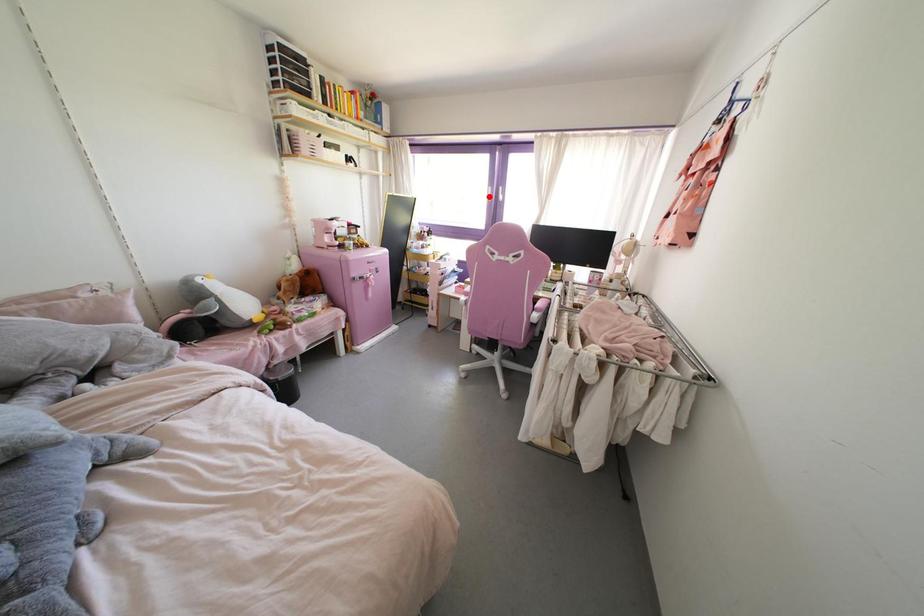
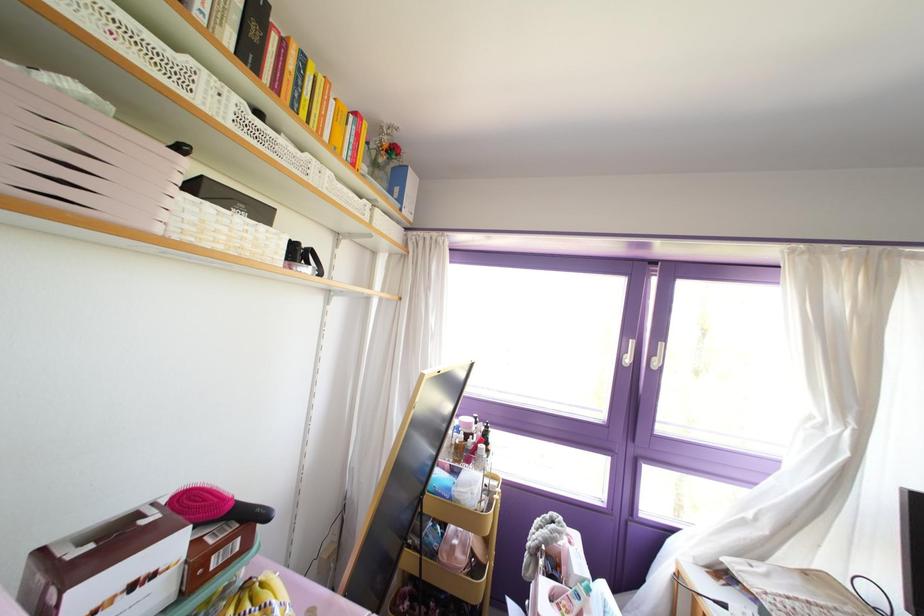
Where in the second image is the point corresponding to the highlighted location from the first image?

(626, 360)